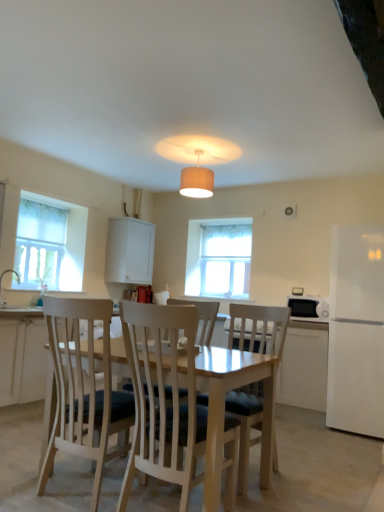
At what (x,y) coordinates should I click in order to perform the action: click on empty space that is ontop of white textured window at center, the 1th window positioned from the right (from a real-world perspective). Please return your answer as a coordinate pair (x, y). The height and width of the screenshot is (512, 384). Looking at the image, I should click on [220, 224].